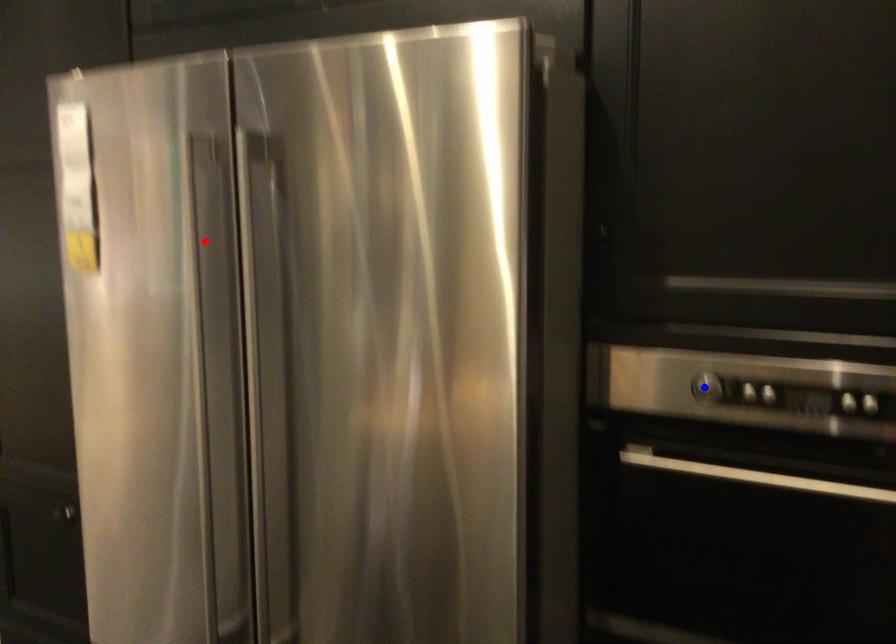
Question: In the image, two points are highlighted. Which point is nearer to the camera? Reply with the corresponding letter.

Choices:
 (A) blue point
 (B) red point

Answer: (A)